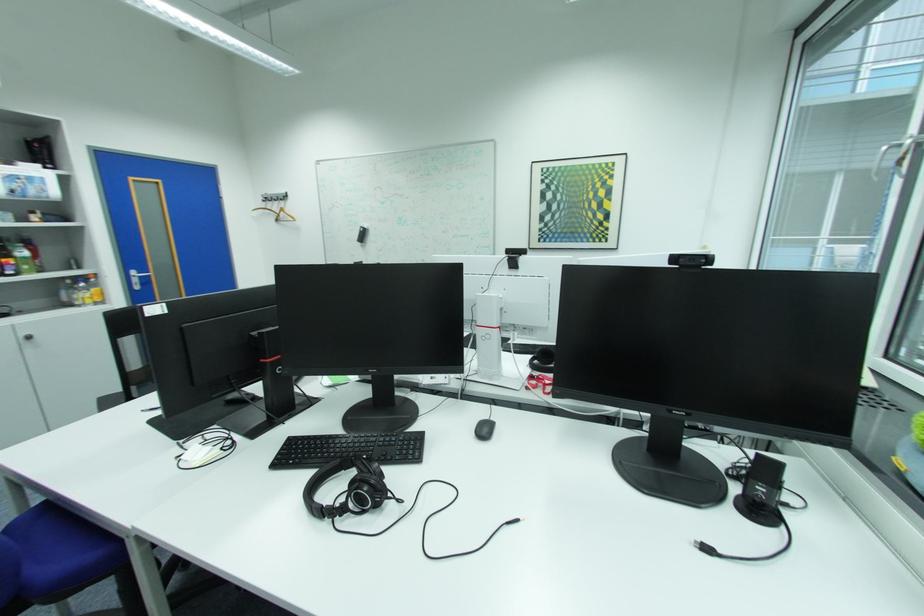
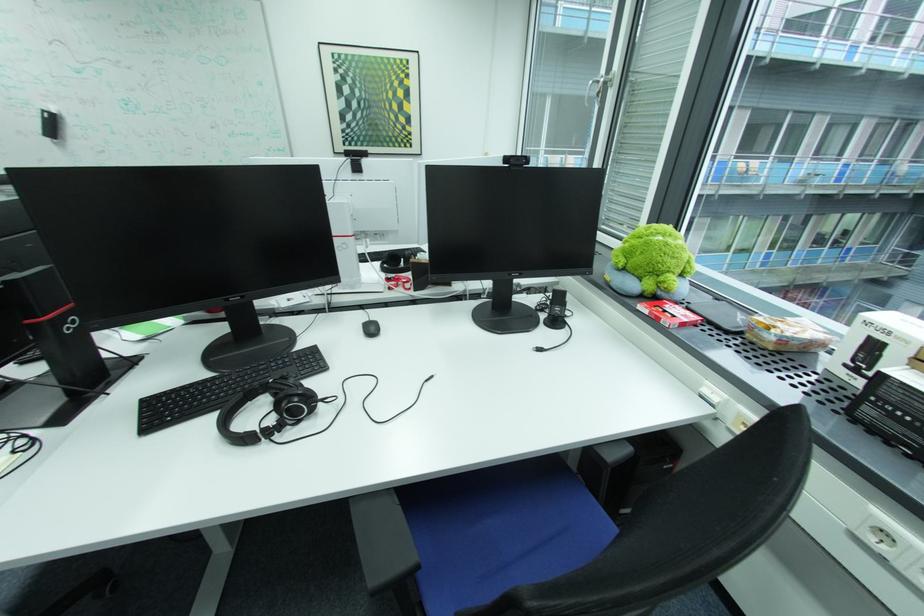
Locate, in the second image, the point that corresponds to point (678, 411) in the first image.

(518, 275)